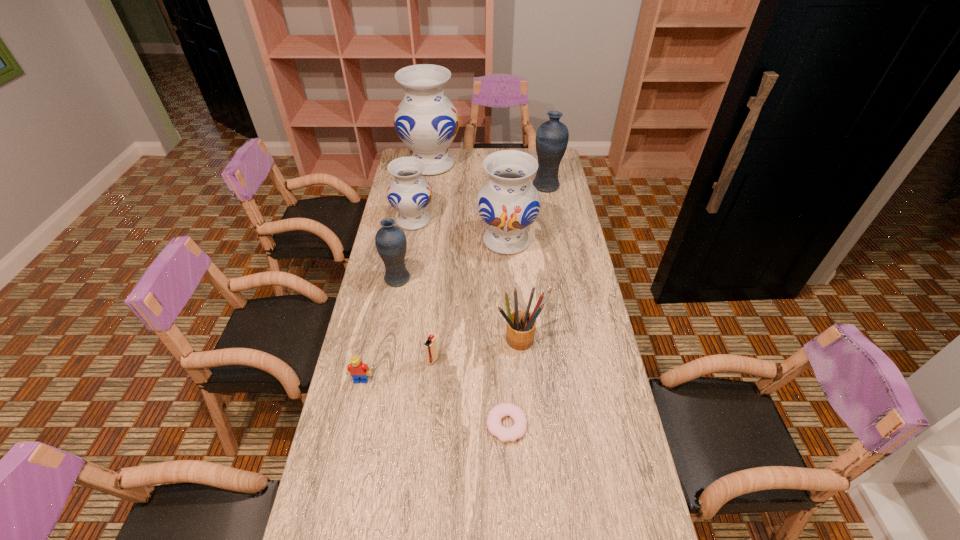
This screenshot has width=960, height=540. Find the location of `vase that is the nearest to the fourth vase from left to right`. vase that is the nearest to the fourth vase from left to right is located at coordinates (410, 194).

What are the coordinates of `vase that stands as the second closest to the red igniter` in the screenshot? It's located at (x=508, y=204).

You are a GUI agent. You are given a task and a screenshot of the screen. Output one action in this format:
    pyautogui.click(x=<x>, y=<y>)
    Task: Click on the red vase that can be found as the second closest to the Lego
    
    Given the screenshot: What is the action you would take?
    pyautogui.click(x=410, y=194)

Locate which red vase is the closest to the sixth farthest object. Please provide its 2D coordinates. Your answer should be formatted as a tuple, i.e. [(x, y)], where the tuple contains the x and y coordinates of a point satisfying the conditions above.

[(508, 204)]

The image size is (960, 540). Identify the location of vacant space that satisfies the following two spatial constraints: 1. on the face of the eighth farthest object; 2. on the left side of the shortest object. (351, 424).

Where is `vacant space that satisfies the following two spatial constraints: 1. on the back side of the right blue vase; 2. on the left side of the smallest red vase`? This screenshot has width=960, height=540. vacant space that satisfies the following two spatial constraints: 1. on the back side of the right blue vase; 2. on the left side of the smallest red vase is located at coordinates (420, 186).

You are a GUI agent. You are given a task and a screenshot of the screen. Output one action in this format:
    pyautogui.click(x=<x>, y=<y>)
    Task: Click on the free space in the image that satisfies the following two spatial constraints: 1. on the back side of the igniter; 2. on the right side of the pencil box
    This screenshot has width=960, height=540.
    Given the screenshot: What is the action you would take?
    pyautogui.click(x=434, y=339)